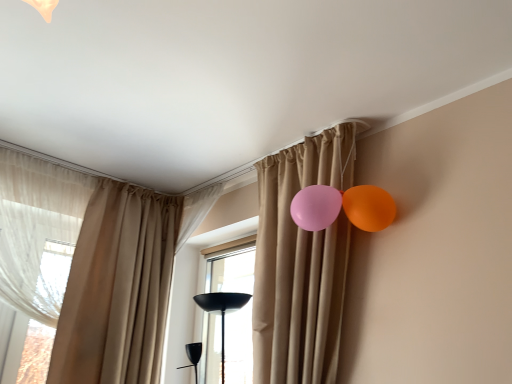
Question: From the image's perspective, is sheer white curtain at left, the 4th curtain viewed from the right, located above or below beige fabric curtain at center, which ranks as the 3th curtain in left-to-right order?

Choices:
 (A) below
 (B) above

Answer: (A)

Question: Considering the positions of sheer white curtain at left, the first curtain in the left-to-right sequence, and beige fabric curtain at center, which ranks as the 3th curtain in left-to-right order, in the image, is sheer white curtain at left, the first curtain in the left-to-right sequence, wider or thinner than beige fabric curtain at center, which ranks as the 3th curtain in left-to-right order,?

Choices:
 (A) thin
 (B) wide

Answer: (A)

Question: Which is nearer to the matte beige curtain at upper center, the 4th curtain in the left-to-right sequence?

Choices:
 (A) orange matte balloon at upper right
 (B) beige fabric curtain at center, which ranks as the 3th curtain in left-to-right order
 (C) sheer white curtain at left, the first curtain in the left-to-right sequence
 (D) transparent glass window at center
 (E) beige fabric curtain at left, the 2th curtain positioned from the left

Answer: (A)

Question: Which is nearer to the matte beige curtain at upper center, which ranks as the first curtain in right-to-left order?

Choices:
 (A) sheer white curtain at left, the 4th curtain viewed from the right
 (B) beige fabric curtain at left, the 2th curtain positioned from the left
 (C) transparent glass window at center
 (D) orange matte balloon at upper right
 (E) beige fabric curtain at center, which ranks as the 3th curtain in left-to-right order

Answer: (D)